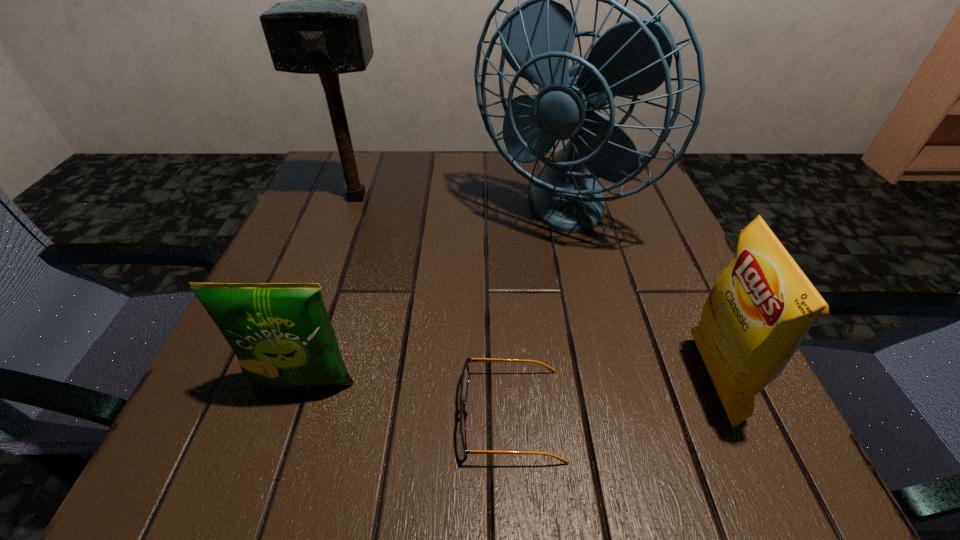
Locate an element on the screen. vacant space at the far right corner of the desktop is located at coordinates (652, 194).

In the image, there is a desktop. Where is `vacant space at the near right corner`? The image size is (960, 540). vacant space at the near right corner is located at coordinates (749, 444).

This screenshot has height=540, width=960. I want to click on vacant region between the left crisp (potato chip) and the tallest object, so click(429, 296).

This screenshot has height=540, width=960. Identify the location of free space between the fan and the spectacles. (533, 312).

The height and width of the screenshot is (540, 960). Find the location of `free space between the second shortest object and the tallest object`. free space between the second shortest object and the tallest object is located at coordinates (429, 296).

The height and width of the screenshot is (540, 960). I want to click on empty space that is in between the shorter crisp (potato chip) and the right crisp (potato chip), so click(508, 382).

Locate an element on the screen. The image size is (960, 540). free spot between the fan and the right crisp (potato chip) is located at coordinates (634, 295).

This screenshot has width=960, height=540. What are the coordinates of `free space between the left crisp (potato chip) and the mallet` in the screenshot? It's located at (330, 291).

This screenshot has width=960, height=540. What are the coordinates of `vacant area between the fourth shortest object and the shortest object` in the screenshot? It's located at (434, 306).

At what (x,y) coordinates should I click in order to perform the action: click on vacant region between the tallest object and the left crisp (potato chip). Please return your answer as a coordinate pair (x, y). The width and height of the screenshot is (960, 540). Looking at the image, I should click on (429, 296).